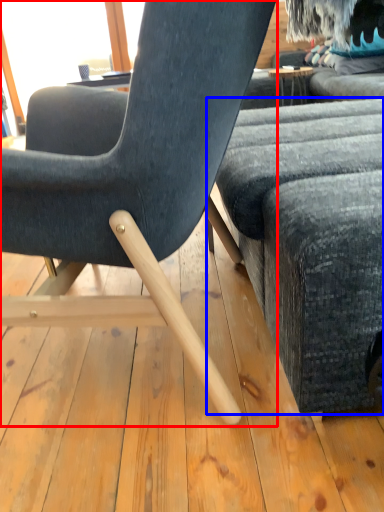
Question: Which of the following is the closest to the observer, chair (highlighted by a red box) or studio couch (highlighted by a blue box)?

Choices:
 (A) chair
 (B) studio couch

Answer: (A)